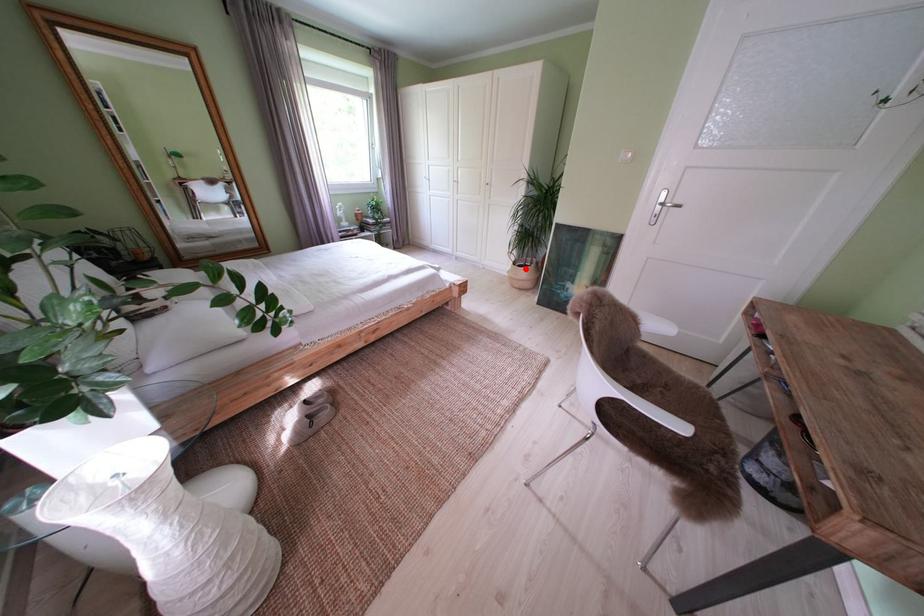
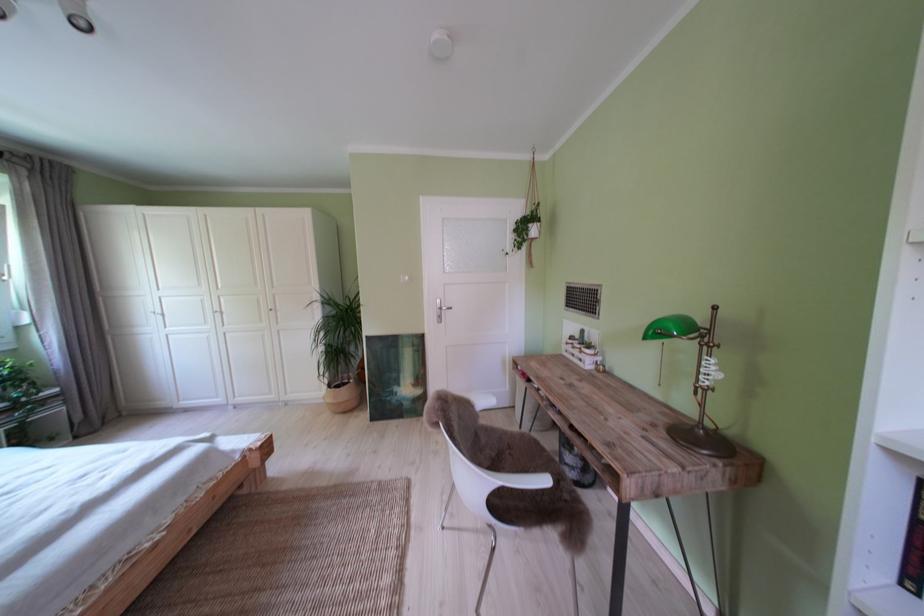
Question: I am providing you with two images of the same scene from different viewpoints. Given a red point in image1, look at the same physical point in image2. Is it:

Choices:
 (A) Closer to the viewpoint
 (B) Farther from the viewpoint

Answer: (B)